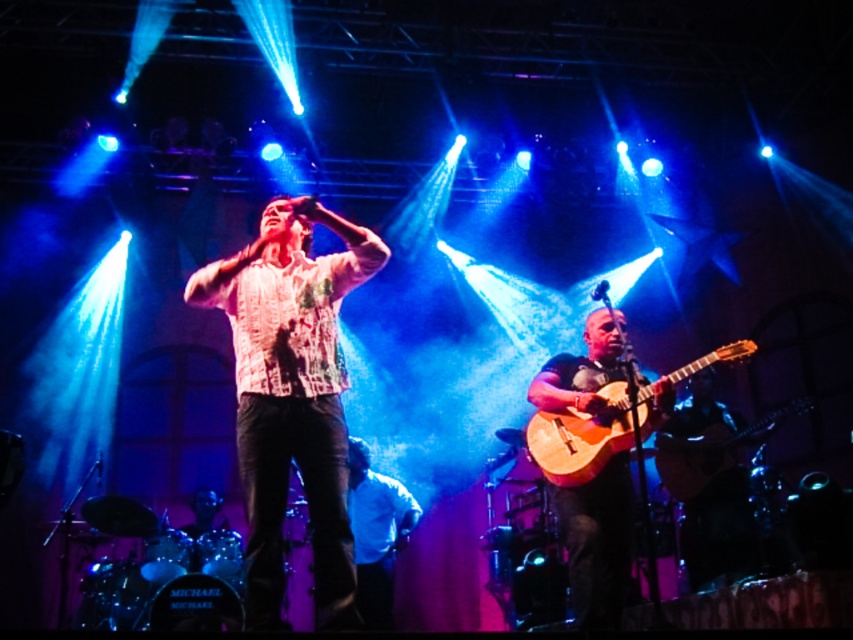
Question: Does wooden acoustic guitar at center appear on the left side of wooden acoustic guitar at lower right?

Choices:
 (A) yes
 (B) no

Answer: (A)

Question: Which of these objects is positioned farthest from the printed cotton shirt at center?

Choices:
 (A) acoustic wood guitar at center
 (B) wooden acoustic guitar at lower right
 (C) wooden acoustic guitar at center

Answer: (A)

Question: Can you confirm if wooden acoustic guitar at center is positioned above wooden acoustic guitar at lower right?

Choices:
 (A) yes
 (B) no

Answer: (B)

Question: Which of the following is the farthest from the observer?

Choices:
 (A) (730, 358)
 (B) (578, 576)
 (C) (312, 340)
 (D) (364, 541)

Answer: (D)

Question: Does printed cotton shirt at center appear over acoustic wood guitar at center?

Choices:
 (A) yes
 (B) no

Answer: (A)

Question: Which point is farther to the camera?

Choices:
 (A) (631, 369)
 (B) (277, 352)
 (C) (711, 429)

Answer: (C)